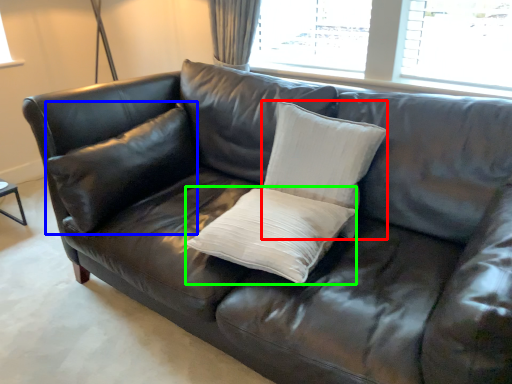
Question: Which object is positioned closest to pillow (highlighted by a red box)? Select from pillow (highlighted by a blue box) and pillow (highlighted by a green box).

Choices:
 (A) pillow
 (B) pillow

Answer: (B)